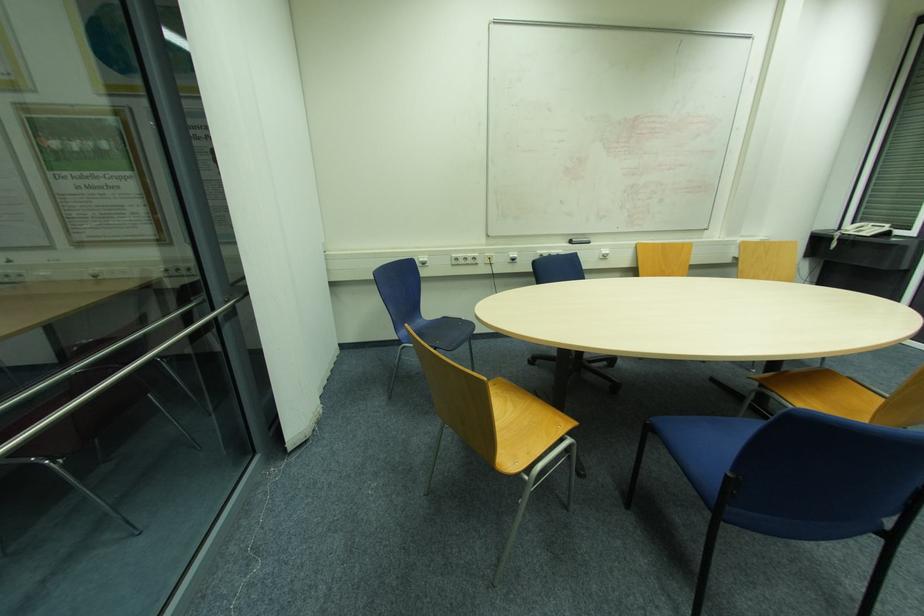
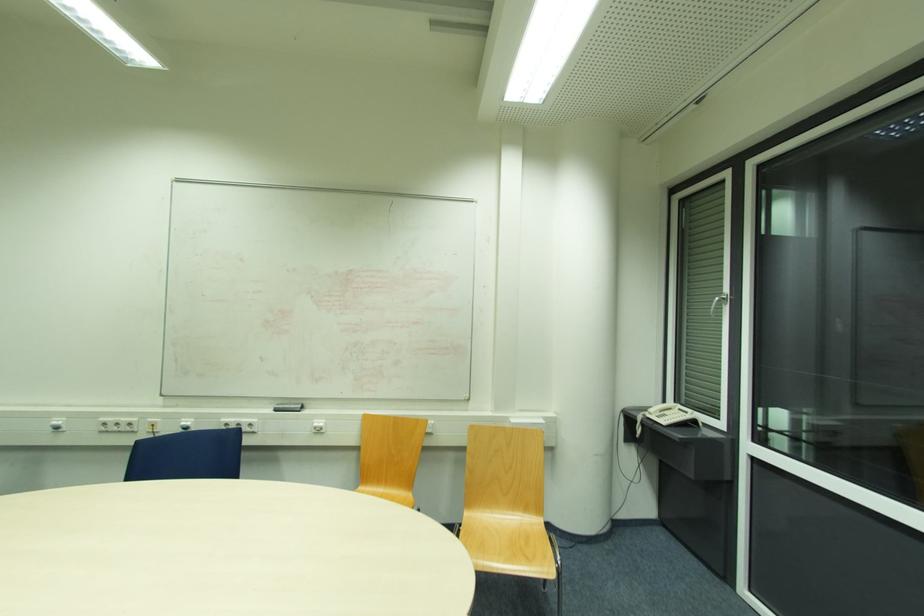
Question: In a continuous first-person perspective shot, in which direction is the camera moving?

Choices:
 (A) Left
 (B) Right
 (C) Forward
 (D) Backward

Answer: (B)